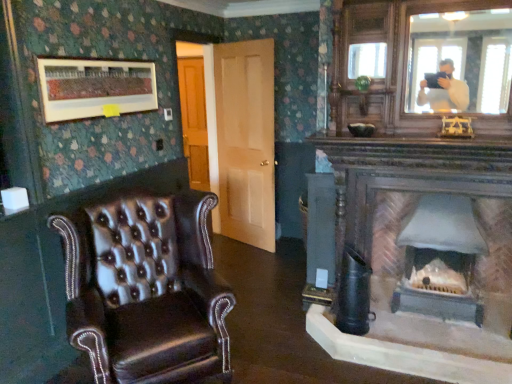
Question: Is point (471, 276) positioned closer to the camera than point (94, 77)?

Choices:
 (A) closer
 (B) farther

Answer: (B)

Question: Looking at their shapes, would you say matte gray stone fireplace at center is wider or thinner than matte wooden picture frame at upper left?

Choices:
 (A) wide
 (B) thin

Answer: (A)

Question: Estimate the real-world distances between objects in this image. Which object is farther from the leather wingback chair at left?

Choices:
 (A) matte gray stone fireplace at center
 (B) light brown wood door at center
 (C) matte wooden picture frame at upper left

Answer: (B)

Question: Which object is positioned closest to the matte wooden picture frame at upper left?

Choices:
 (A) matte gray stone fireplace at center
 (B) leather wingback chair at left
 (C) light brown wood door at center

Answer: (B)